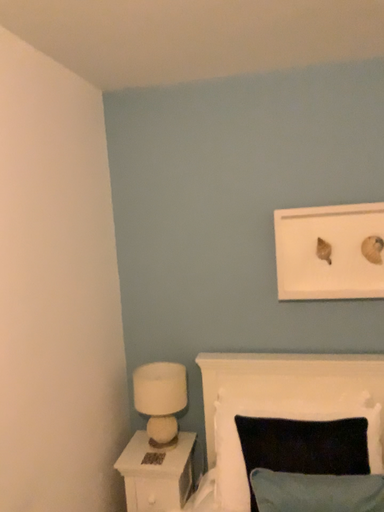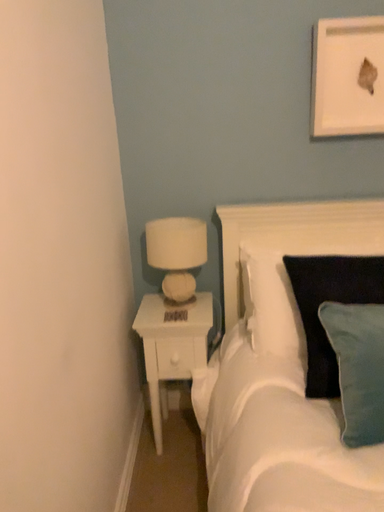
Question: Which way did the camera rotate in the video?

Choices:
 (A) rotated right
 (B) rotated left

Answer: (A)